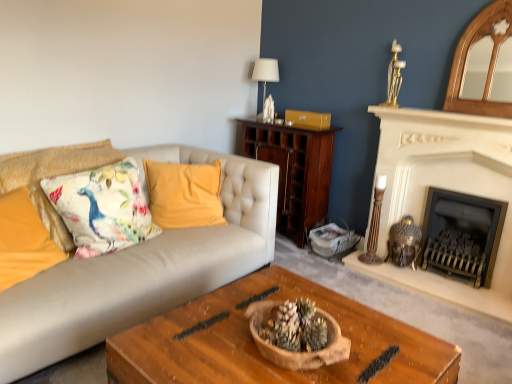
Locate an element on the screen. blank space above wooden bowl at center (from a real-world perspective) is located at coordinates (259, 344).